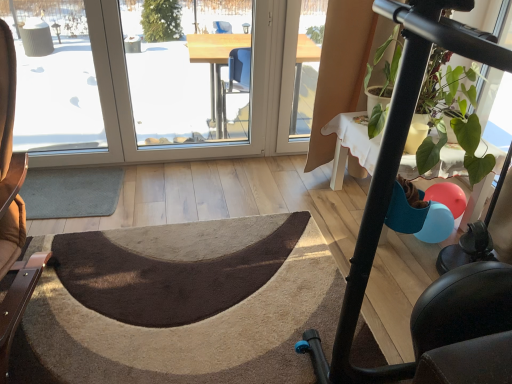
Question: Would you say transparent glass window at center, marked as the second window screen in a left-to-right arrangement, is part of brown leather chair at left's contents?

Choices:
 (A) yes
 (B) no

Answer: (B)

Question: Can you confirm if brown leather chair at left is shorter than transparent glass window at center, marked as the 1th window screen in a right-to-left arrangement?

Choices:
 (A) no
 (B) yes

Answer: (A)

Question: From a real-world perspective, is brown leather chair at left under transparent glass window at center, marked as the 1th window screen in a right-to-left arrangement?

Choices:
 (A) yes
 (B) no

Answer: (B)

Question: Is brown leather chair at left not within transparent glass window at center, marked as the second window screen in a left-to-right arrangement?

Choices:
 (A) no
 (B) yes

Answer: (B)

Question: Could you tell me if brown leather chair at left is facing transparent glass window at center, marked as the 1th window screen in a right-to-left arrangement?

Choices:
 (A) no
 (B) yes

Answer: (A)

Question: Can you confirm if brown leather chair at left is smaller than transparent glass window at center, marked as the second window screen in a left-to-right arrangement?

Choices:
 (A) no
 (B) yes

Answer: (A)

Question: Is transparent glass window at center, marked as the second window screen in a left-to-right arrangement, closer to camera compared to transparent glass window at upper left, the 1th window screen viewed from the left?

Choices:
 (A) yes
 (B) no

Answer: (B)

Question: From a real-world perspective, is transparent glass window at center, marked as the 1th window screen in a right-to-left arrangement, over transparent glass window at upper left, the 1th window screen viewed from the left?

Choices:
 (A) no
 (B) yes

Answer: (A)

Question: Considering the relative sizes of transparent glass window at center, marked as the second window screen in a left-to-right arrangement, and transparent glass window at upper left, the second window screen positioned from the right, in the image provided, is transparent glass window at center, marked as the second window screen in a left-to-right arrangement, bigger than transparent glass window at upper left, the second window screen positioned from the right,?

Choices:
 (A) no
 (B) yes

Answer: (A)

Question: Can you confirm if transparent glass window at center, marked as the 1th window screen in a right-to-left arrangement, is wider than transparent glass window at upper left, the 1th window screen viewed from the left?

Choices:
 (A) yes
 (B) no

Answer: (B)

Question: Is transparent glass window at center, marked as the 1th window screen in a right-to-left arrangement, to the right of transparent glass window at upper left, the 1th window screen viewed from the left, from the viewer's perspective?

Choices:
 (A) no
 (B) yes

Answer: (B)

Question: Does transparent glass window at center, marked as the 1th window screen in a right-to-left arrangement, turn towards transparent glass window at upper left, the 1th window screen viewed from the left?

Choices:
 (A) no
 (B) yes

Answer: (A)

Question: Is gray carpet at lower left, the second doormat ordered from the bottom, at the right side of green matte plant at right?

Choices:
 (A) yes
 (B) no

Answer: (B)